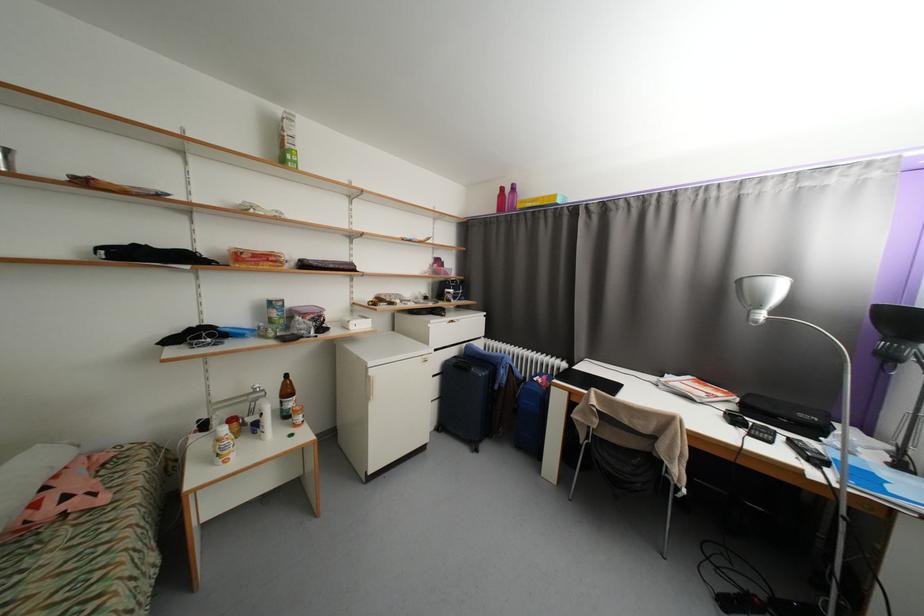
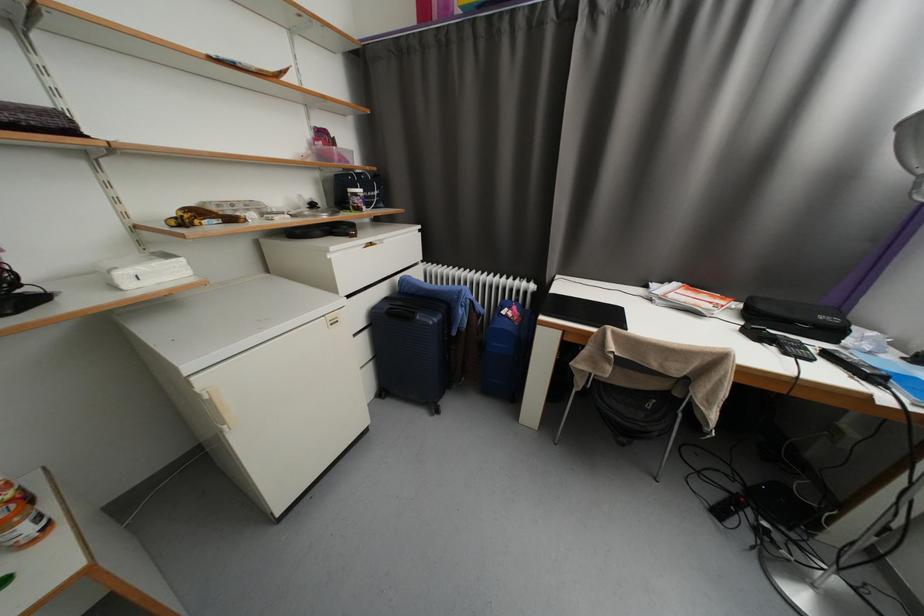
Question: In a continuous first-person perspective shot, in which direction is the camera moving?

Choices:
 (A) Left
 (B) Right
 (C) Forward
 (D) Backward

Answer: (C)